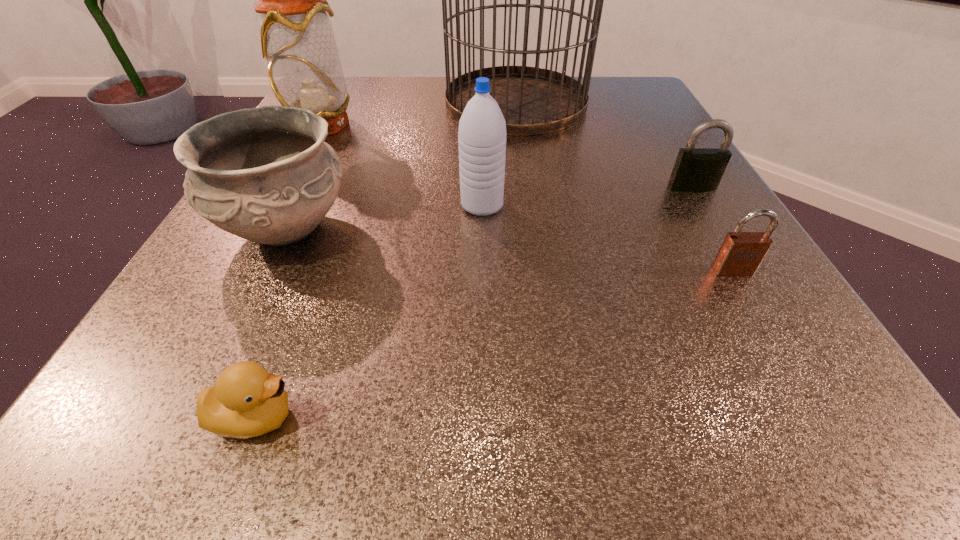
Identify the location of birdcage. The width and height of the screenshot is (960, 540). (533, 100).

You are a GUI agent. You are given a task and a screenshot of the screen. Output one action in this format:
    pyautogui.click(x=<x>, y=<y>)
    Task: Click on the oil lamp
    The image size is (960, 540).
    Given the screenshot: What is the action you would take?
    pyautogui.click(x=297, y=39)

Identify the location of the fifth shortest object. (482, 128).

You are a GUI agent. You are given a task and a screenshot of the screen. Output one action in this format:
    pyautogui.click(x=<x>, y=<y>)
    Task: Click on the pottery
    
    Given the screenshot: What is the action you would take?
    pyautogui.click(x=265, y=174)

In order to click on the taller padlock in this screenshot , I will do `click(696, 169)`.

Locate an element on the screen. The height and width of the screenshot is (540, 960). the fifth tallest object is located at coordinates (696, 169).

Find the location of a particular element. the shorter padlock is located at coordinates (741, 253).

Locate an element on the screen. Image resolution: width=960 pixels, height=540 pixels. the second shortest object is located at coordinates (741, 253).

Locate an element on the screen. This screenshot has width=960, height=540. duckling is located at coordinates [x=247, y=401].

Where is `the nearest object`? the nearest object is located at coordinates (247, 401).